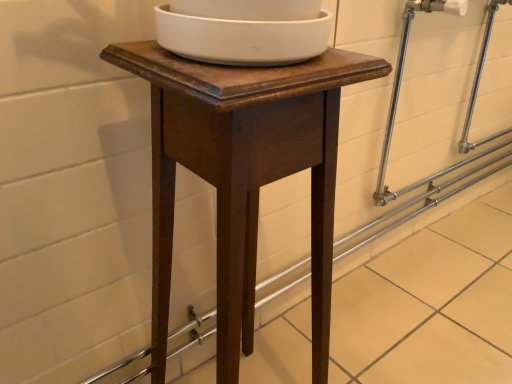
The height and width of the screenshot is (384, 512). In order to click on free spot above dark wood pedestal at center (from a real-world perspective) in this screenshot , I will do `click(251, 67)`.